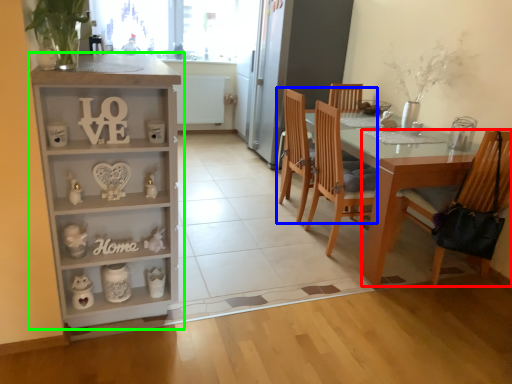
Question: Which is farther away from chair (highlighted by a red box)? chair (highlighted by a blue box) or cabinetry (highlighted by a green box)?

Choices:
 (A) chair
 (B) cabinetry

Answer: (B)